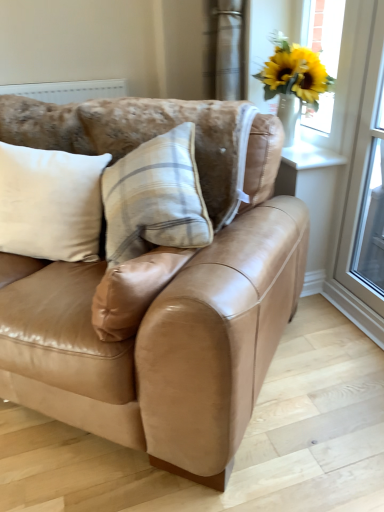
The image size is (384, 512). Identify the location of transparent glass screen door at right. (366, 185).

What do you see at coordinates (293, 81) in the screenshot? I see `yellow artificial flowers in vase at upper right` at bounding box center [293, 81].

The image size is (384, 512). Describe the element at coordinates (164, 332) in the screenshot. I see `tan leather couch at center` at that location.

I want to click on white glossy window sill at upper right, so click(x=310, y=156).

Locate an element on the screen. The height and width of the screenshot is (512, 384). screen door that appears below the white glossy window sill at upper right (from the image's perspective) is located at coordinates (366, 185).

Is transparent glass screen door at right thinner than white glossy window sill at upper right?

Yes.

Considering the sizes of transparent glass screen door at right and white glossy window sill at upper right in the image, is transparent glass screen door at right bigger or smaller than white glossy window sill at upper right?

transparent glass screen door at right is bigger than white glossy window sill at upper right.

Does white glossy window sill at upper right appear on the left side of transparent glass screen door at right?

Yes, white glossy window sill at upper right is to the left of transparent glass screen door at right.

Is white glossy window sill at upper right directly adjacent to transparent glass screen door at right?

white glossy window sill at upper right and transparent glass screen door at right are clearly separated.

Which is correct: white glossy window sill at upper right is inside transparent glass screen door at right, or outside of it?

white glossy window sill at upper right lies outside transparent glass screen door at right.

Is transparent glass window at upper right taller or shorter than satin curtain at upper right?

In the image, transparent glass window at upper right appears to be taller than satin curtain at upper right.

Does transparent glass window at upper right turn towards satin curtain at upper right?

No, transparent glass window at upper right is not oriented towards satin curtain at upper right.

Considering the relative positions of transparent glass window at upper right and satin curtain at upper right in the image provided, is transparent glass window at upper right to the right of satin curtain at upper right from the viewer's perspective?

Indeed, transparent glass window at upper right is positioned on the right side of satin curtain at upper right.

From the image's perspective, which one is positioned lower, transparent glass window at upper right or satin curtain at upper right?

transparent glass window at upper right is shown below in the image.

Does tan leather couch at center turn towards white soft cushion at left?

Yes, tan leather couch at center is turned towards white soft cushion at left.

Considering the positions of point (253, 191) and point (7, 149), is point (253, 191) closer or farther from the camera than point (7, 149)?

Point (253, 191) is closer to the camera than point (7, 149).

Is transparent glass screen door at right turned away from white soft cushion at left?

transparent glass screen door at right does not have its back to white soft cushion at left.

Looking at this image, how different are the orientations of transparent glass screen door at right and white soft cushion at left in degrees?

transparent glass screen door at right and white soft cushion at left are facing 52.2 degrees away from each other.

Is transparent glass screen door at right at the right side of white soft cushion at left?

Yes, transparent glass screen door at right is to the right of white soft cushion at left.

Is tan leather couch at center directly adjacent to transparent glass window at upper right?

tan leather couch at center is not next to transparent glass window at upper right, and they're not touching.

Consider the image. Is transparent glass window at upper right surrounded by tan leather couch at center?

No.

Considering the positions of objects white soft cushion at left and yellow artificial flowers in vase at upper right in the image provided, who is more to the left, white soft cushion at left or yellow artificial flowers in vase at upper right?

→ Positioned to the left is white soft cushion at left.

Is white soft cushion at left completely or partially outside of yellow artificial flowers in vase at upper right?

Yes, white soft cushion at left is outside of yellow artificial flowers in vase at upper right.

From the image's perspective, is white soft cushion at left located above or below yellow artificial flowers in vase at upper right?

From the image's perspective, white soft cushion at left appears below yellow artificial flowers in vase at upper right.

Between white soft cushion at left and yellow artificial flowers in vase at upper right, which one has more height?

With more height is yellow artificial flowers in vase at upper right.

Find the location of a particular element. The image size is (384, 512). screen door that is on the right side of white glossy window sill at upper right is located at coordinates (366, 185).

This screenshot has width=384, height=512. What are the coordinates of `window sill that is above the transparent glass screen door at right (from the image's perspective)` in the screenshot? It's located at (310, 156).

Considering their positions, is white glossy window sill at upper right positioned further to transparent glass window at upper right than satin curtain at upper right?

The object further to transparent glass window at upper right is satin curtain at upper right.

Looking at the image, which one is located closer to white soft cushion at left, white glossy window sill at upper right or satin curtain at upper right?

white glossy window sill at upper right is positioned closer to the anchor white soft cushion at left.

Which object lies nearer to the anchor point white soft cushion at left, white glossy window sill at upper right or yellow artificial flowers in vase at upper right?

white glossy window sill at upper right.

From the image, which object appears to be nearer to yellow artificial flowers in vase at upper right, white soft cushion at left or transparent glass window at upper right?

transparent glass window at upper right is positioned closer to the anchor yellow artificial flowers in vase at upper right.

From the image, which object appears to be farther from transparent glass screen door at right, white glossy window sill at upper right or satin curtain at upper right?

satin curtain at upper right.

Based on their spatial positions, is transparent glass screen door at right or white glossy window sill at upper right closer to yellow artificial flowers in vase at upper right?

Among the two, white glossy window sill at upper right is located nearer to yellow artificial flowers in vase at upper right.

When comparing their distances from satin curtain at upper right, does tan leather couch at center or white glossy window sill at upper right seem closer?

white glossy window sill at upper right is positioned closer to the anchor satin curtain at upper right.

Estimate the real-world distances between objects in this image. Which object is further from yellow artificial flowers in vase at upper right, transparent glass window at upper right or satin curtain at upper right?

transparent glass window at upper right lies further to yellow artificial flowers in vase at upper right than the other object.

Identify the location of curtain positioned between tan leather couch at center and transparent glass window at upper right from near to far. (223, 49).

At what (x,y) coordinates should I click in order to perform the action: click on curtain between white soft cushion at left and transparent glass window at upper right from left to right. Please return your answer as a coordinate pair (x, y). This screenshot has height=512, width=384. Looking at the image, I should click on (223, 49).

Identify the location of window situated between white soft cushion at left and transparent glass screen door at right from left to right. This screenshot has height=512, width=384. (312, 200).

Find the location of `pillow between tan leather couch at center and satin curtain at upper right in the front-back direction`. pillow between tan leather couch at center and satin curtain at upper right in the front-back direction is located at coordinates (50, 203).